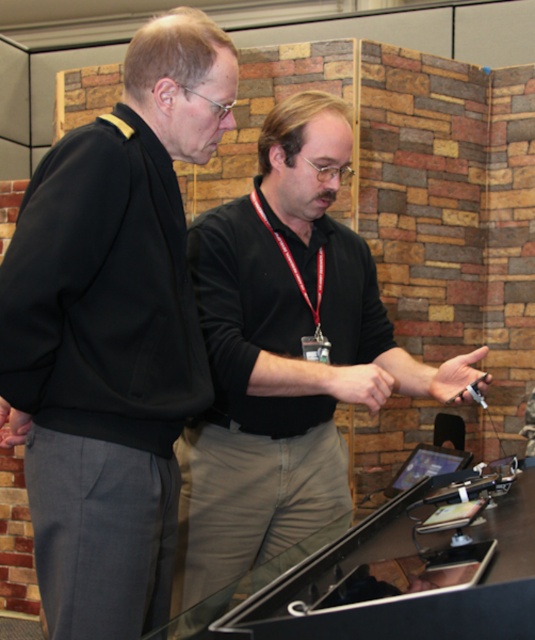
Is point (81, 228) positioned before point (263, 161)?

Yes, point (81, 228) is in front of point (263, 161).

Which of these two, black matte jacket at left or black matte shirt at center, stands shorter?

black matte jacket at left is shorter.

Is point (208, 20) positioned before point (356, 324)?

Yes, point (208, 20) is in front of point (356, 324).

At what (x,y) coordinates should I click in order to perform the action: click on black matte jacket at left. Please return your answer as a coordinate pair (x, y). This screenshot has height=640, width=535. Looking at the image, I should click on [112, 332].